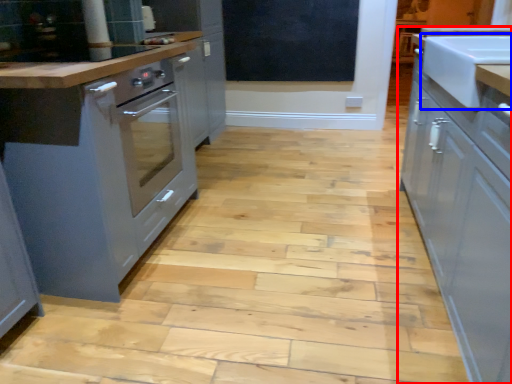
Question: Which point is closer to the camera, cabinetry (highlighted by a red box) or sink (highlighted by a blue box)?

Choices:
 (A) cabinetry
 (B) sink

Answer: (A)